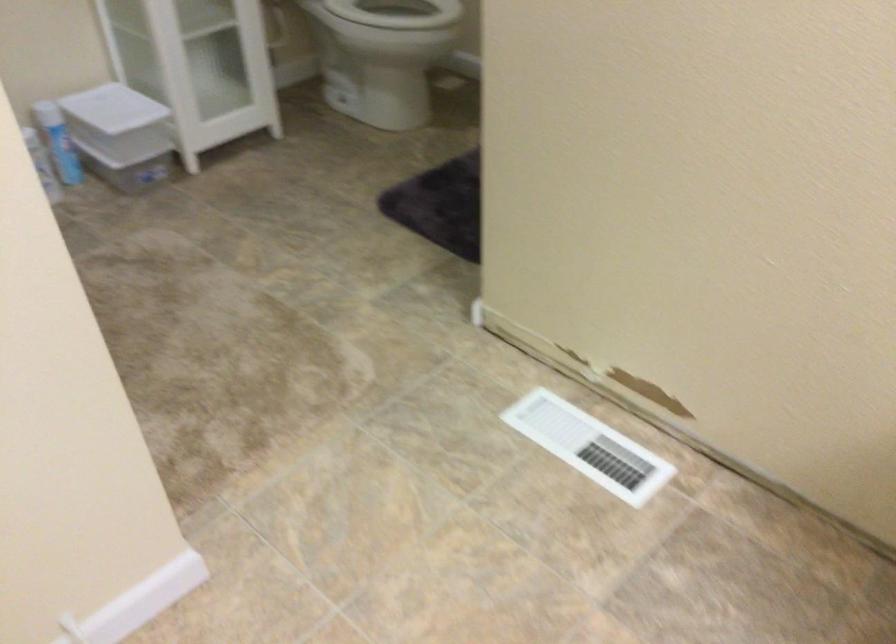
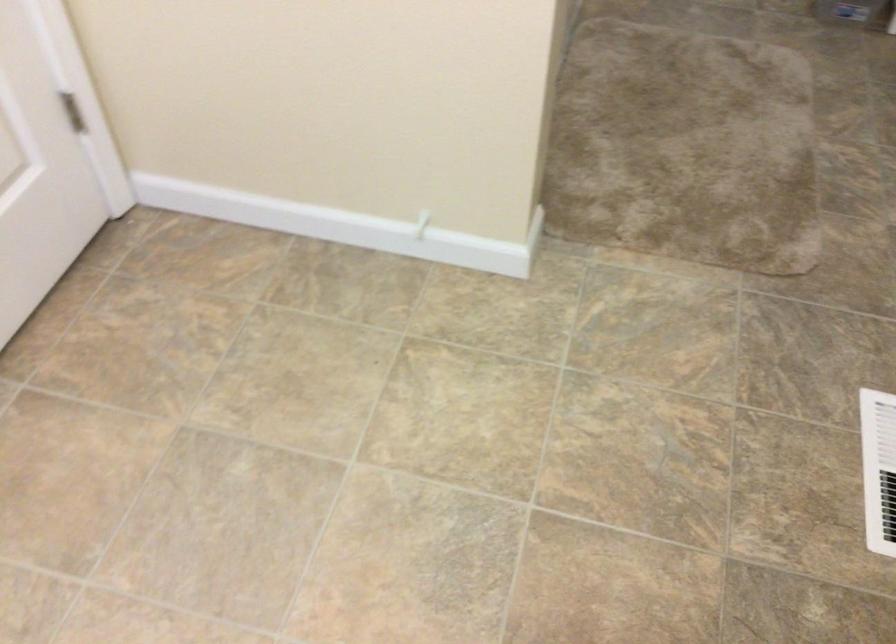
The images are taken continuously from a first-person perspective. In which direction is your viewpoint rotating?

The rotation direction of the camera is left-down.